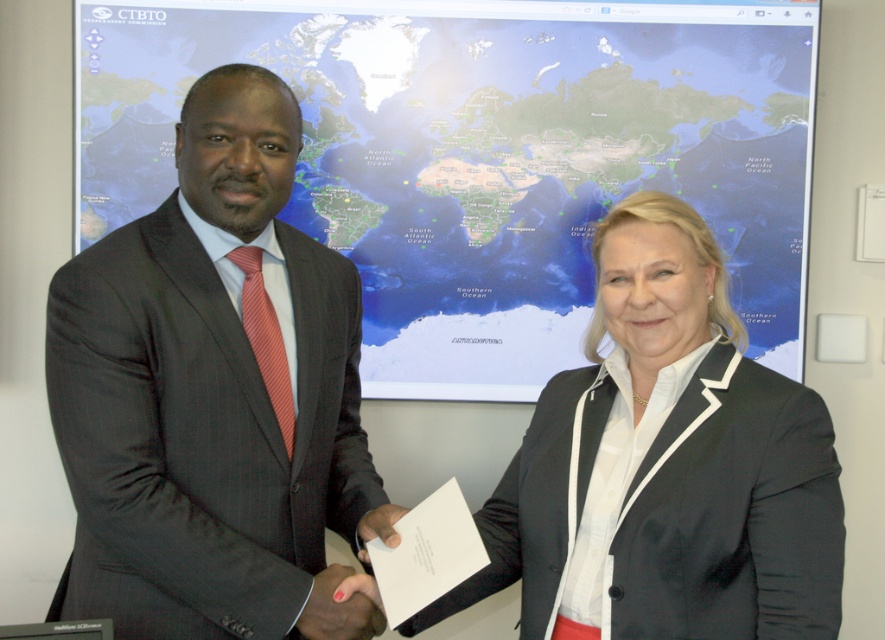
Question: Is matte world map at center above dark gray suit at left?

Choices:
 (A) no
 (B) yes

Answer: (B)

Question: Which object is positioned closest to the matte world map at center?

Choices:
 (A) matte black hand at center
 (B) matte black blazer at center
 (C) nail polish at center

Answer: (B)

Question: Does matte world map at center have a smaller size compared to nail polish at center?

Choices:
 (A) yes
 (B) no

Answer: (B)

Question: Does nail polish at center have a greater width compared to matte black hand at center?

Choices:
 (A) no
 (B) yes

Answer: (B)

Question: Which object appears closest to the camera in this image?

Choices:
 (A) dark gray suit at left
 (B) nail polish at center

Answer: (A)

Question: Considering the real-world distances, which object is farthest from the matte world map at center?

Choices:
 (A) matte black blazer at center
 (B) matte black hand at center
 (C) dark gray suit at left
 (D) nail polish at center

Answer: (D)